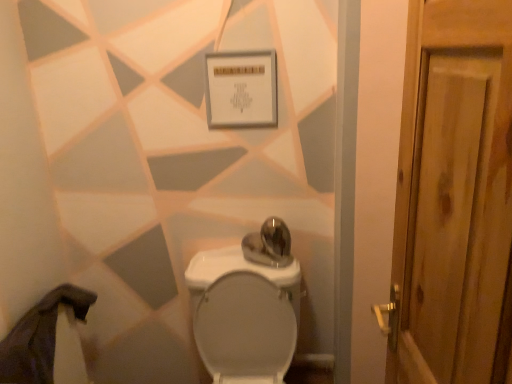
Question: Based on their sizes in the image, would you say white matte sign at upper center is bigger or smaller than white glossy toilet at center?

Choices:
 (A) big
 (B) small

Answer: (B)

Question: From the image's perspective, is white matte sign at upper center positioned above or below white glossy toilet at center?

Choices:
 (A) below
 (B) above

Answer: (B)

Question: Relative to white glossy toilet at center, is white matte sign at upper center in front or behind?

Choices:
 (A) behind
 (B) front

Answer: (A)

Question: From a real-world perspective, is white glossy toilet at center above or below white matte sign at upper center?

Choices:
 (A) above
 (B) below

Answer: (B)

Question: Based on their positions, is white glossy toilet at center located to the left or right of white matte sign at upper center?

Choices:
 (A) left
 (B) right

Answer: (B)

Question: Is white glossy toilet at center wider or thinner than white matte sign at upper center?

Choices:
 (A) thin
 (B) wide

Answer: (B)

Question: Considering the positions of white glossy toilet at center and white matte sign at upper center in the image, is white glossy toilet at center taller or shorter than white matte sign at upper center?

Choices:
 (A) short
 (B) tall

Answer: (B)